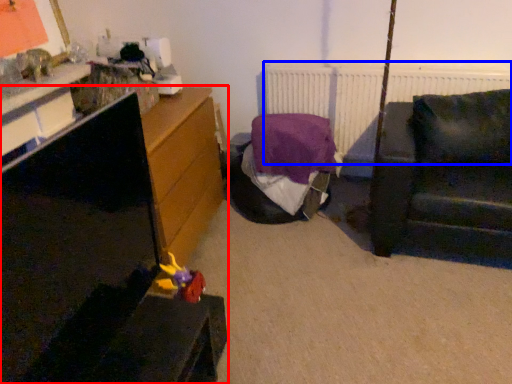
Question: Which object appears farthest to the camera in this image, furniture (highlighted by a red box) or radiator (highlighted by a blue box)?

Choices:
 (A) furniture
 (B) radiator

Answer: (B)